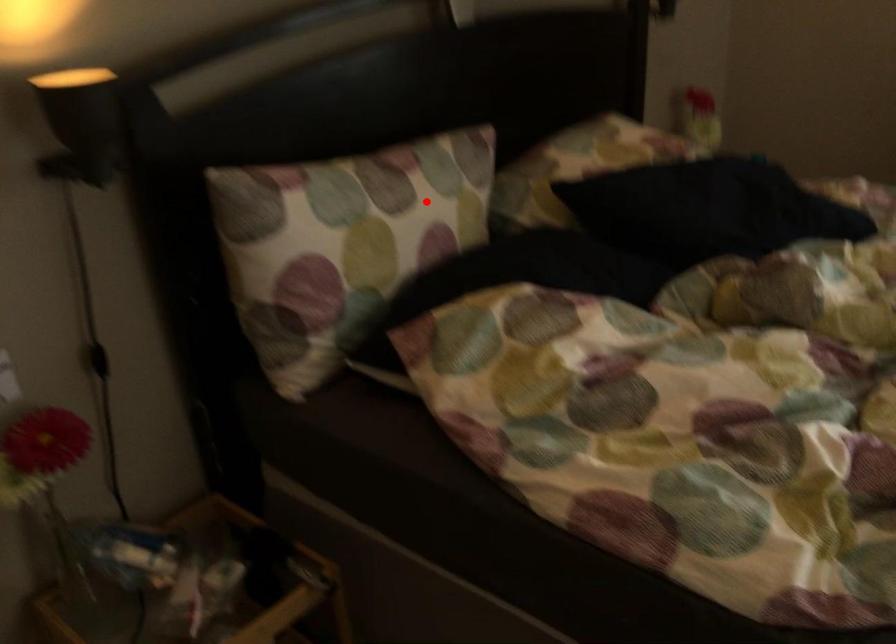
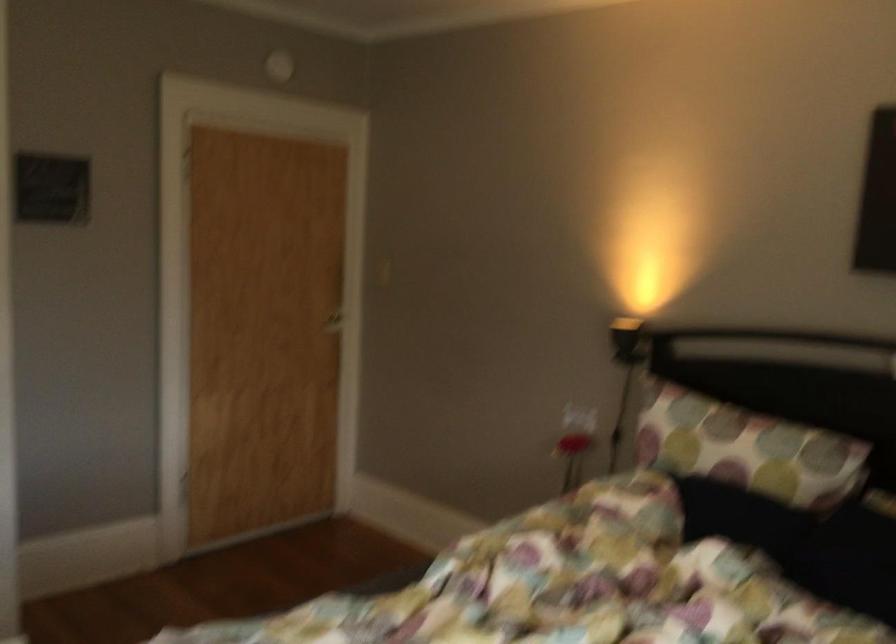
Question: I am providing you with two images of the same scene from different viewpoints. In image1, a red point is highlighted. Considering the same 3D point in image2, which of the following is correct?

Choices:
 (A) It is closer
 (B) It is farther

Answer: (B)